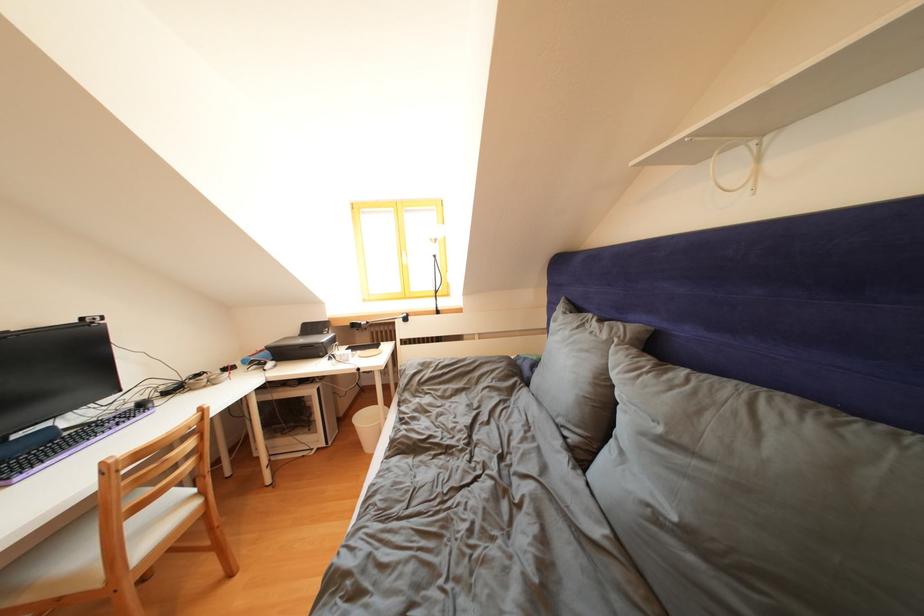
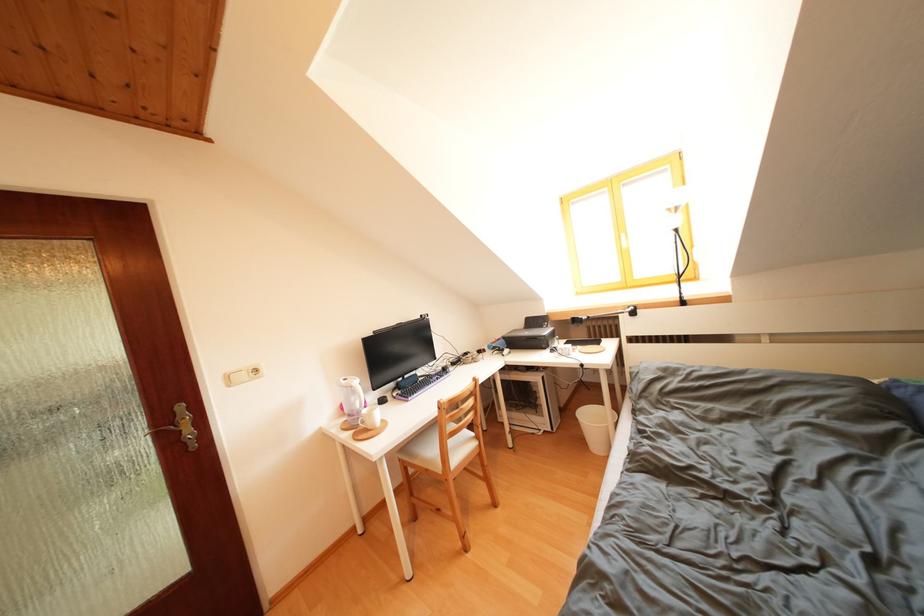
Question: The images are taken continuously from a first-person perspective. In which direction is your viewpoint rotating?

Choices:
 (A) Left
 (B) Right
 (C) Up
 (D) Down

Answer: (A)